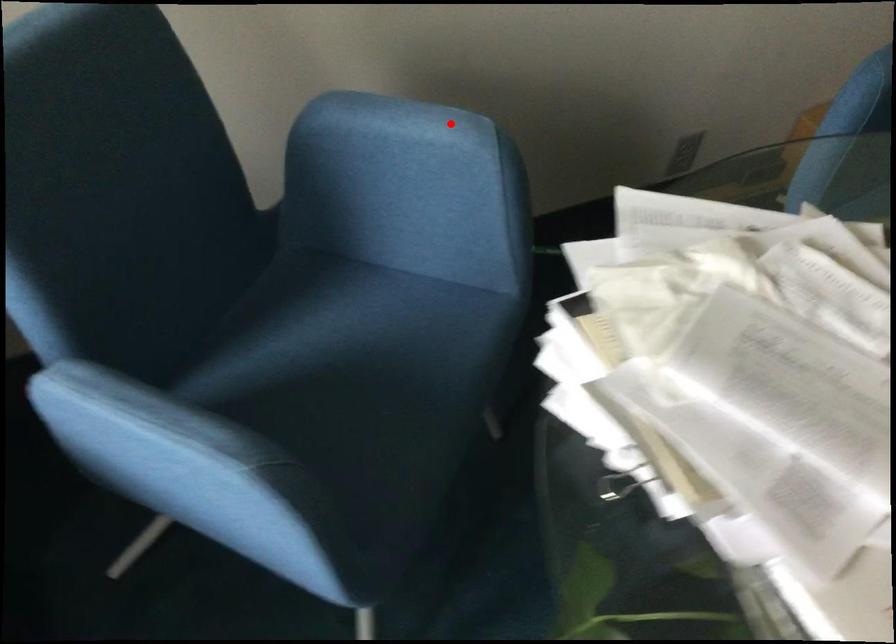
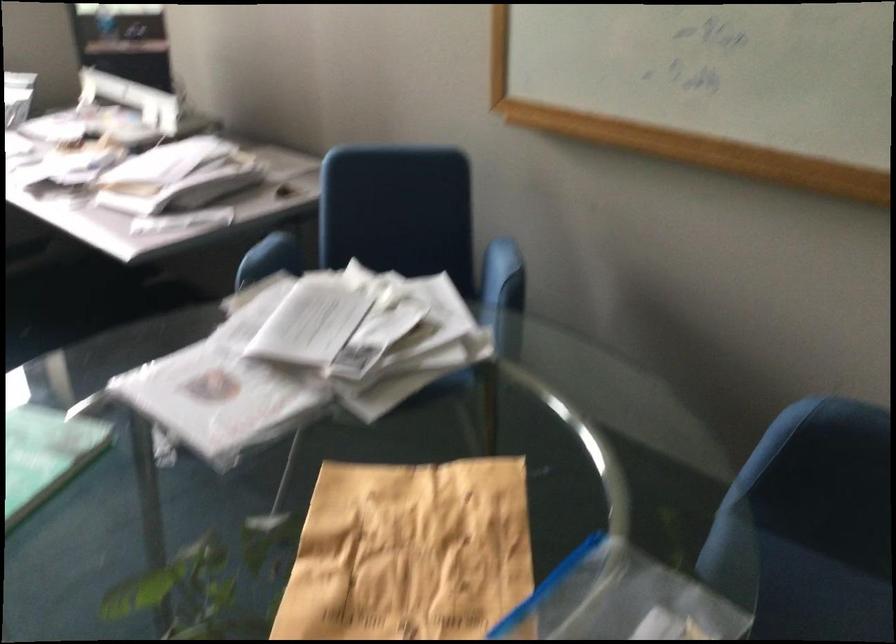
Question: A red point is marked in image1. In image2, is the corresponding 3D point closer to the camera or farther? Reply with the corresponding letter.

Choices:
 (A) The corresponding 3D point is closer.
 (B) The corresponding 3D point is farther.

Answer: (B)